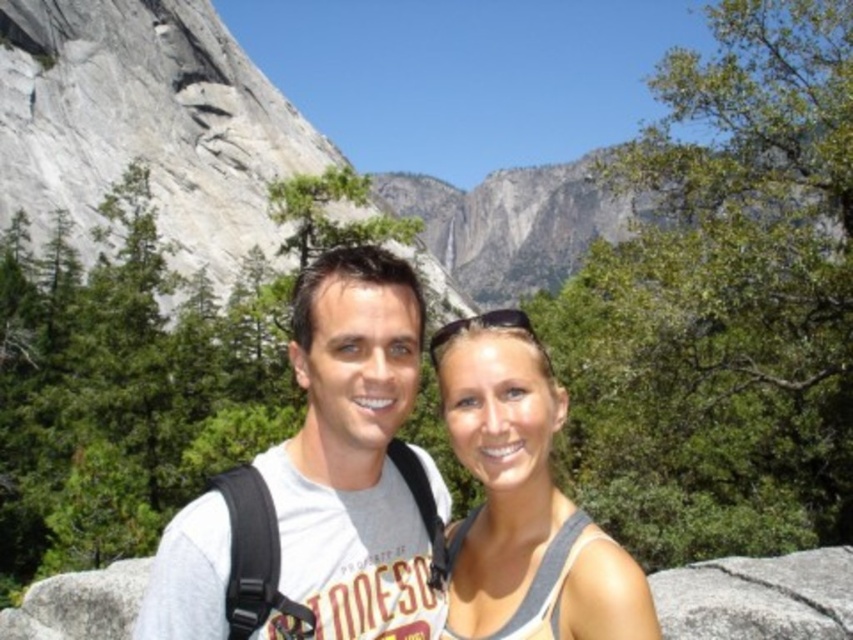
You are a photographer trying to capture a photo of the gray granite mountain at upper left and the matte gray tank top at center. Based on their positions, which object is higher in the image?

The gray granite mountain at upper left is located above the matte gray tank top at center, so it is higher in the image.